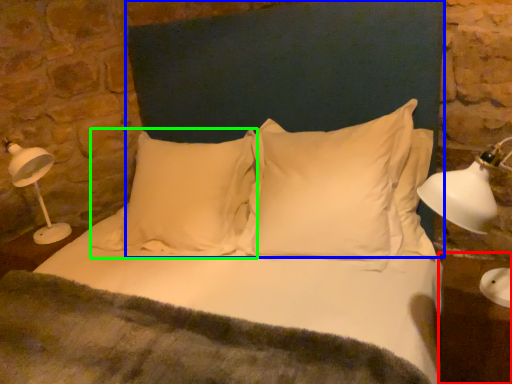
Question: Based on their relative distances, which object is nearer to table (highlighted by a red box)? Choose from headboard (highlighted by a blue box) and pillow (highlighted by a green box).

Choices:
 (A) headboard
 (B) pillow

Answer: (A)